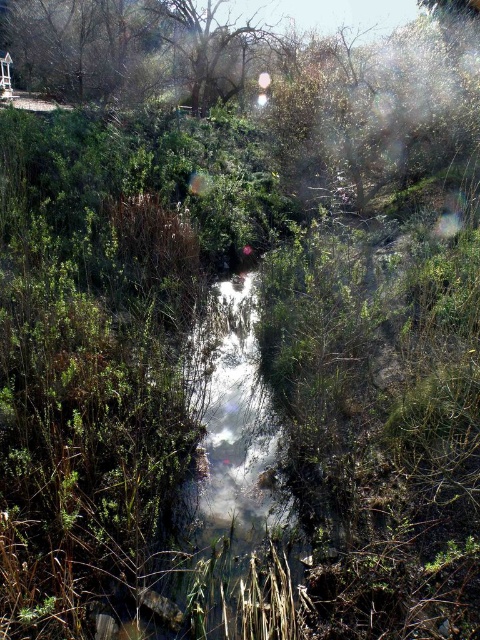
Question: Which point appears farthest from the camera in this image?

Choices:
 (A) (394, 83)
 (B) (227, 90)

Answer: (B)

Question: Does green leafy tree at upper center have a lesser width compared to brown textured tree at upper center?

Choices:
 (A) yes
 (B) no

Answer: (B)

Question: Which object is farther from the camera taking this photo?

Choices:
 (A) brown textured tree at upper center
 (B) green leafy tree at upper center

Answer: (A)

Question: Does green leafy tree at upper center appear over brown textured tree at upper center?

Choices:
 (A) yes
 (B) no

Answer: (B)

Question: Can you confirm if green leafy tree at upper center is positioned to the left of brown textured tree at upper center?

Choices:
 (A) yes
 (B) no

Answer: (B)